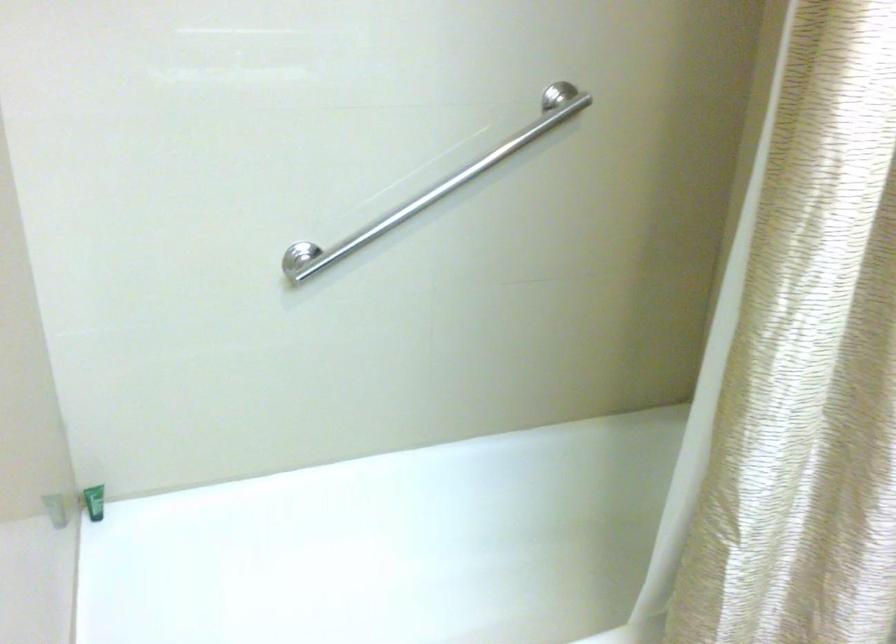
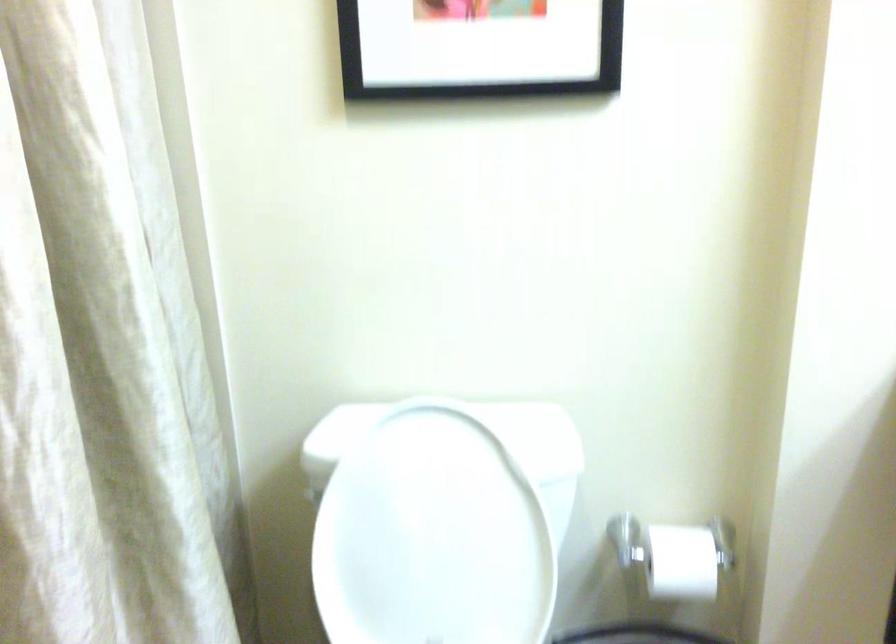
Question: The images are taken continuously from a first-person perspective. In which direction is your viewpoint rotating?

Choices:
 (A) Left
 (B) Right
 (C) Up
 (D) Down

Answer: (B)